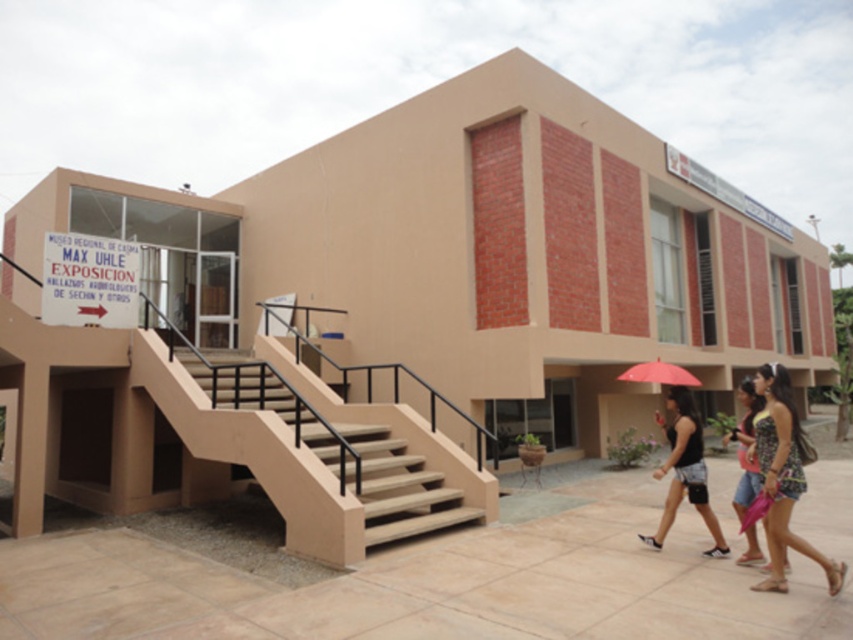
Between beige concrete stairs at center and floral strapless dress at lower right, which one has less height?

floral strapless dress at lower right

Measure the distance from beige concrete stairs at center to floral strapless dress at lower right.

15.72 feet

Which is behind, point (479, 506) or point (801, 477)?

The point (479, 506) is more distant.

Image resolution: width=853 pixels, height=640 pixels. Identify the location of beige concrete stairs at center. (323, 456).

Which is more to the right, floral strapless dress at lower right or black cotton shorts at lower right?

floral strapless dress at lower right

Does floral strapless dress at lower right have a larger size compared to black cotton shorts at lower right?

Yes, floral strapless dress at lower right is bigger than black cotton shorts at lower right.

I want to click on floral strapless dress at lower right, so click(x=784, y=477).

Is point (791, 460) positioned before point (123, 252)?

Yes.

Which of these two, floral strapless dress at lower right or white paper sign at upper left, stands taller?

Standing taller between the two is floral strapless dress at lower right.

What are the coordinates of `floral strapless dress at lower right` in the screenshot? It's located at (784, 477).